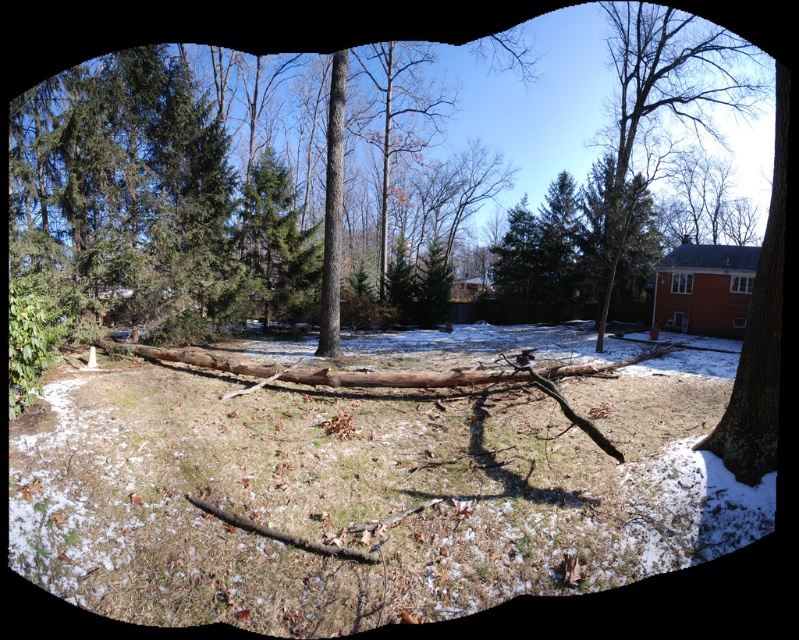
You are a hiker who wants to navigate from the smooth brown tree trunk at center to the brown rough tree at upper right. Given that your hiking gear can handle slopes up to 15 degrees, can you safely traverse the 14.59 meters between them?

The distance between the brown rough tree at upper right and smooth brown tree trunk at center is 14.59 meters. However, the scene description mentions an uneven ground with patches of snow and scattered leaves, which may create slopes steeper than 15 degrees. Without specific slope information, it is uncertain if the path is safe for your gear.

You are a bird looking for a place to perch. You see a brown rough tree at upper right and a smooth brown tree trunk at center. Which tree is taller and would provide a higher vantage point?

The brown rough tree at upper right is much taller than the smooth brown tree trunk at center, so it would provide a higher vantage point for perching.

You are standing in the winter scene and want to take a photo of both the brown rough wood log at center and the brown rough tree at upper right. Which object will appear smaller in your photo?

The brown rough wood log at center will appear smaller in the photo because it is not as tall as the brown rough tree at upper right, but since it is closer to the camera, its apparent size might be similar. However, based on the description, the tree is taller, so it would generally appear larger in the photo.